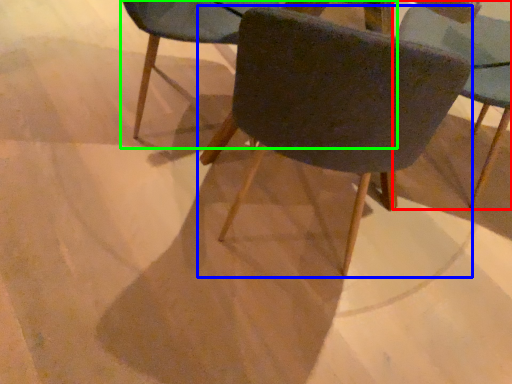
Question: Which object is positioned farthest from chair (highlighted by a red box)? Select from chair (highlighted by a blue box) and chair (highlighted by a green box).

Choices:
 (A) chair
 (B) chair

Answer: (A)